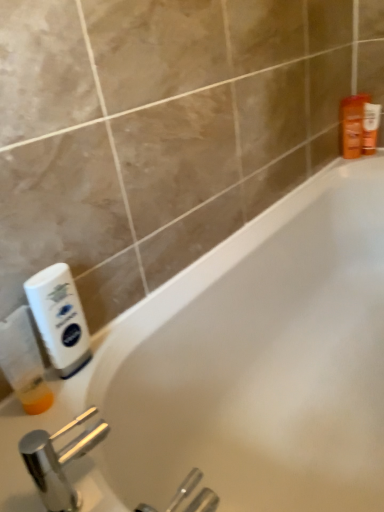
What are the coordinates of `free location in front of translucent plastic bottle at left, acting as the 1th cleaning product starting from the left` in the screenshot? It's located at (34, 461).